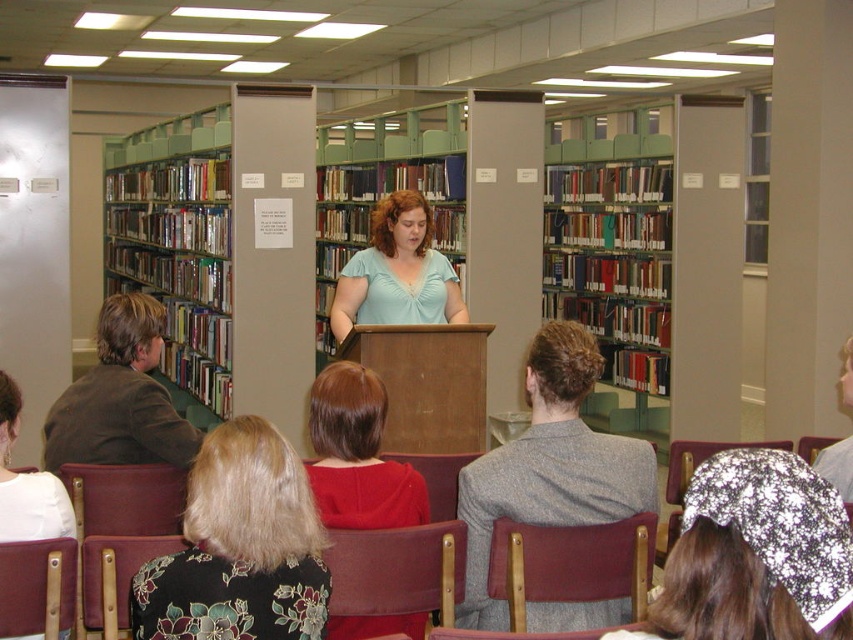
Does wooden chair at lower left have a lesser width compared to velvet red chair at center?

Yes, wooden chair at lower left is thinner than velvet red chair at center.

Describe the element at coordinates (36, 582) in the screenshot. I see `wooden chair at lower left` at that location.

Between point (45, 573) and point (384, 452), which one is positioned in front?

Positioned in front is point (45, 573).

The image size is (853, 640). What are the coordinates of `wooden chair at lower left` in the screenshot? It's located at (36, 582).

Is sparkly silver headscarf at lower right wider than maroon fabric chair at lower left?

No, sparkly silver headscarf at lower right is not wider than maroon fabric chair at lower left.

Looking at this image, does sparkly silver headscarf at lower right appear on the right side of maroon fabric chair at lower left?

Indeed, sparkly silver headscarf at lower right is positioned on the right side of maroon fabric chair at lower left.

Is point (764, 550) in front of point (149, 474)?

Yes, point (764, 550) is closer to viewer.

Locate an element on the screen. sparkly silver headscarf at lower right is located at coordinates (755, 554).

Which is more to the right, gray wool suit at center or smooth red blouse at center?

gray wool suit at center

Who is taller, gray wool suit at center or smooth red blouse at center?

gray wool suit at center

Find the location of a particular element. Image resolution: width=853 pixels, height=640 pixels. gray wool suit at center is located at coordinates (549, 467).